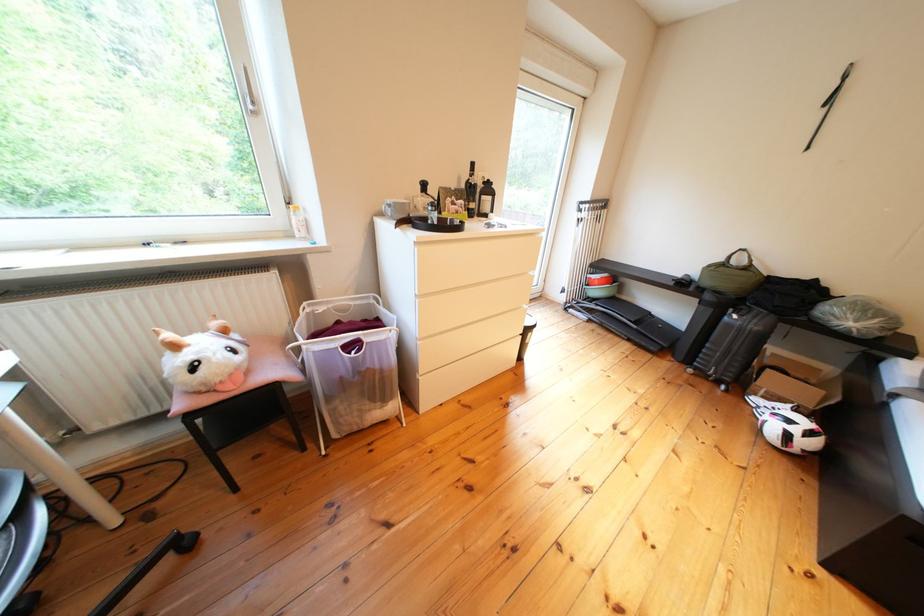
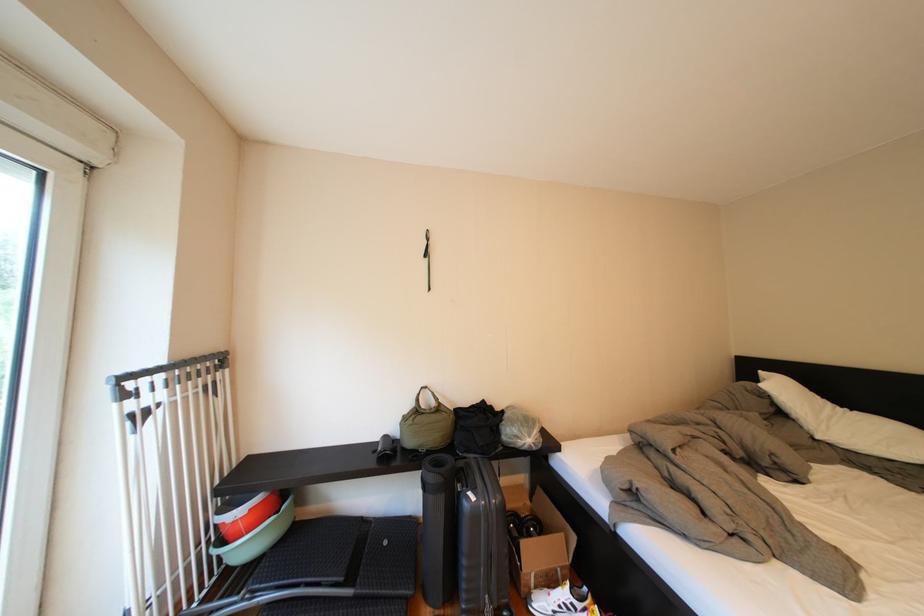
The point at (744, 262) is marked in the first image. Where is the corresponding point in the second image?

(431, 405)